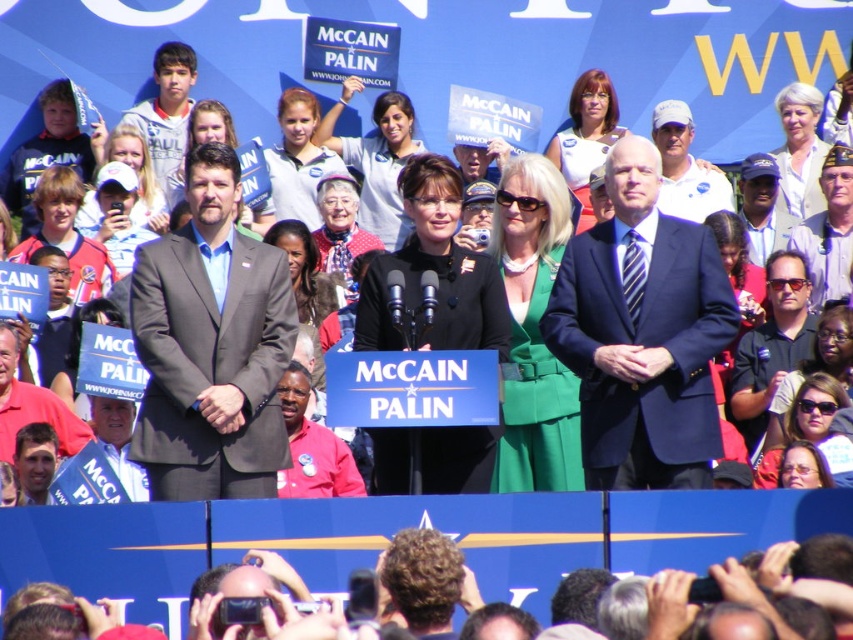
You are attending a political rally and want to take a photo of the point at coordinate (x=184, y=65). The camera you have can focus on objects up to 120 meters away. Will the point be in focus?

The point at coordinate (x=184, y=65) is 121.91 meters away from the viewer, which exceeds the camera focus limit of 120 meters. Therefore, the point will not be in focus.

You are a photographer at the rally and want to capture a photo of both the black shirt at center and the light blue hoodie at upper left. Given that your camera has a fixed focal length lens, which requires you to focus on one subject, which subject should you focus on to ensure both are in the frame?

The black shirt at center has a larger width than the light blue hoodie at upper left. To ensure both are in the frame, focus on the black shirt at center as its larger size will allow the camera to capture both subjects within the fixed focal length.